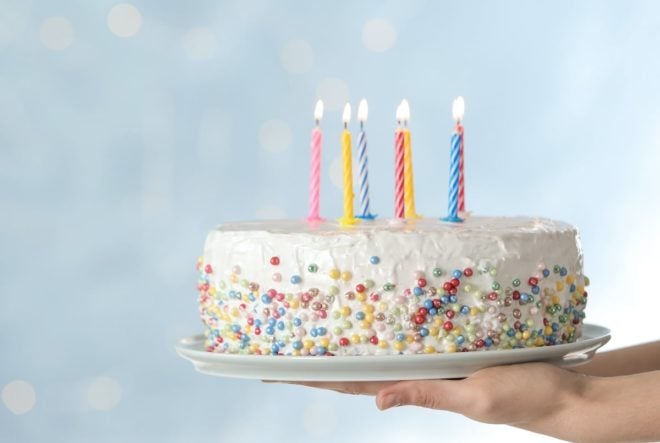
The image size is (660, 443). I want to click on candles, so click(317, 162), click(346, 169), click(364, 167), click(401, 168), click(408, 176), click(453, 172), click(462, 176).